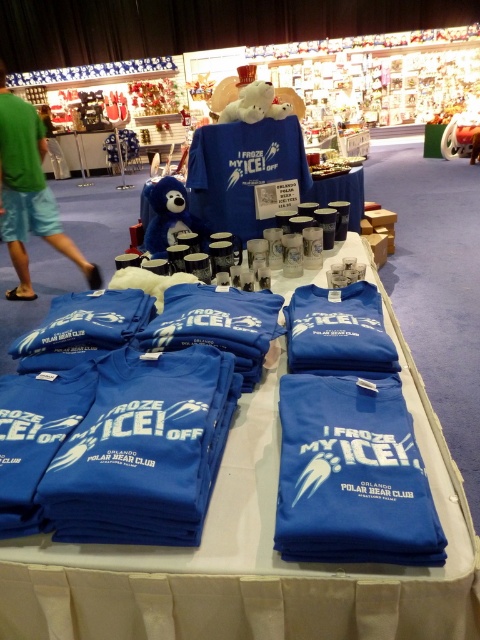
Consider the image. You are standing in front of the Polar Bear Club display table. There are two points marked on the image. One is at coordinate point (290, 433) and the other is at point (15, 216). Which point is closer to your view?

Point (290, 433) is closer to the camera than point (15, 216).